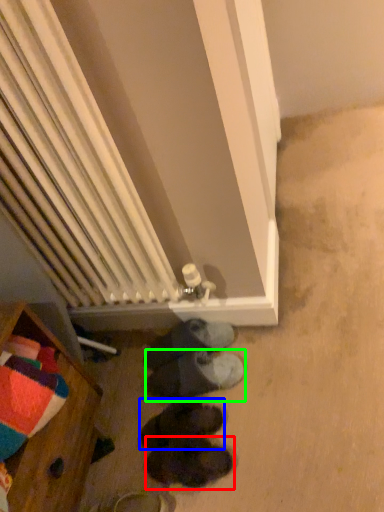
Question: Estimate the real-world distances between objects in this image. Which object is farther from footwear (highlighted by a red box), footwear (highlighted by a blue box) or footwear (highlighted by a green box)?

Choices:
 (A) footwear
 (B) footwear

Answer: (B)